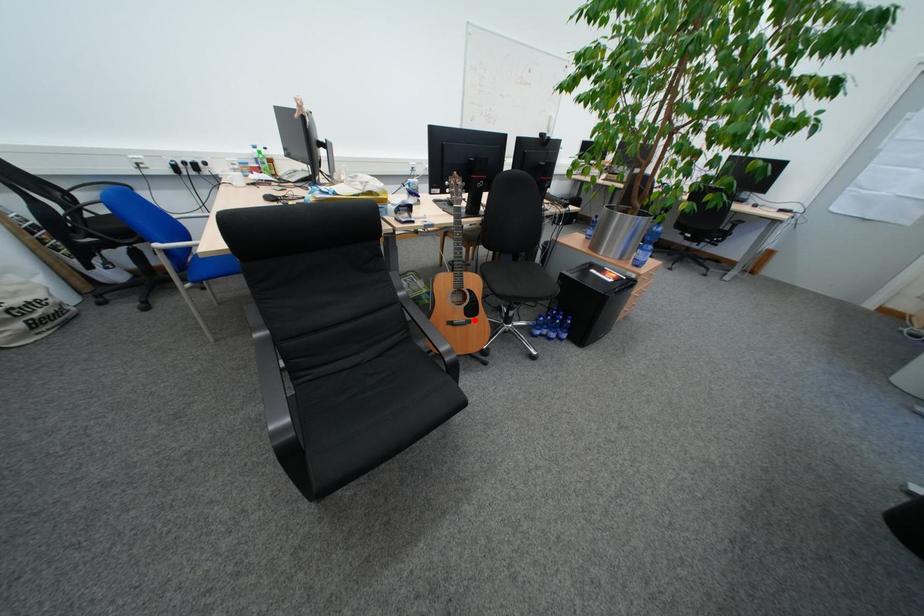
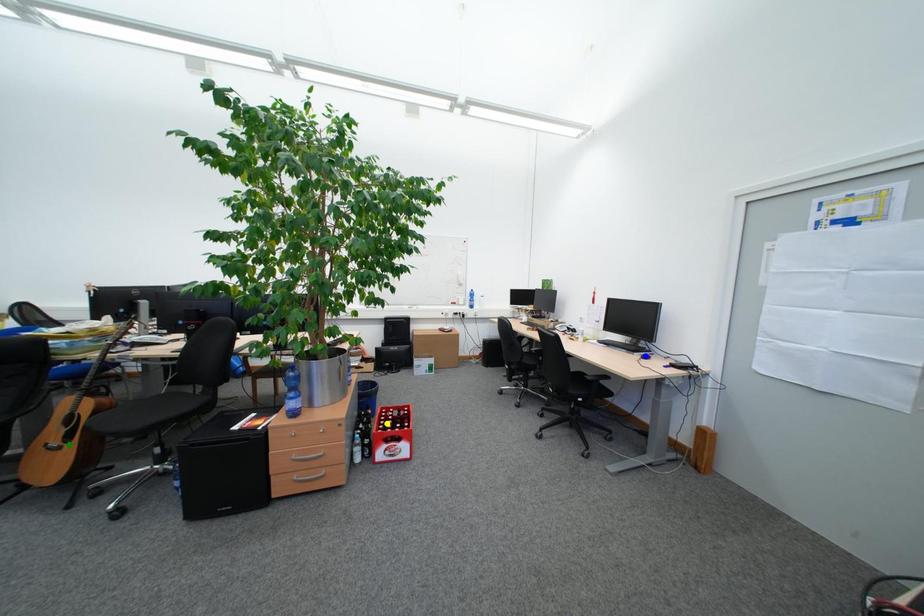
Question: I am providing you with two images of the same scene from different viewpoints. A red point is marked on the first image. You are given multiple points on the second image. Which point in image 2 represents the same 3d spot as the red point in image 1?

Choices:
 (A) green point
 (B) yellow point
 (C) blue point

Answer: (A)